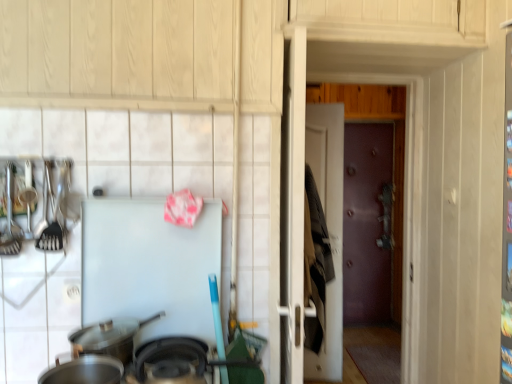
Question: Do you think shiny metallic spoon at left is within white matte refrigerator at center, or outside of it?

Choices:
 (A) inside
 (B) outside

Answer: (B)

Question: From their relative heights in the image, would you say shiny metallic spoon at left is taller or shorter than white matte refrigerator at center?

Choices:
 (A) tall
 (B) short

Answer: (B)

Question: Which is nearer to the shiny metallic spoon at left?

Choices:
 (A) black matte wok at lower center, which is counted as the 2th wok, starting from the front
 (B) white matte refrigerator at center
 (C) brown leather door at center, the second door when ordered from right to left
 (D) silver metallic wok at lower left, the 3th wok from the front
 (E) purple matte door at center

Answer: (B)

Question: Based on their relative distances, which object is farther from the silver metallic wok at lower left, which is the first wok from back to front?

Choices:
 (A) white matte refrigerator at center
 (B) shiny metallic spoon at left
 (C) black matte wok at lower center, which appears as the second wok when viewed from the back
 (D) brown leather door at center, the 2th door viewed from the back
 (E) matte black wok at lower left, which appears as the 1th wok when viewed from the front

Answer: (D)